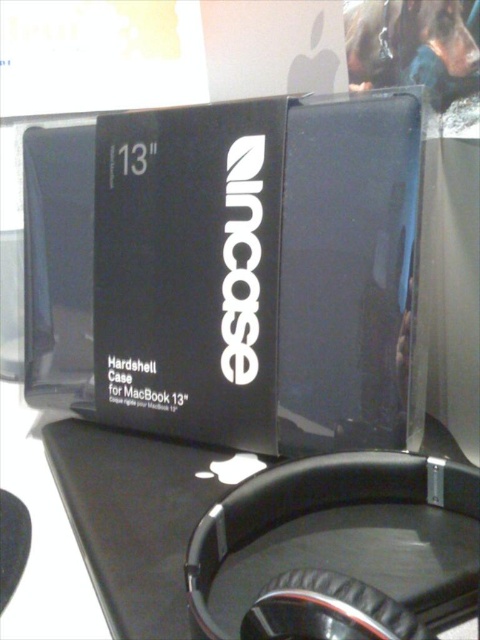
Question: Which point is closer to the camera taking this photo?

Choices:
 (A) (x=72, y=561)
 (B) (x=140, y=144)

Answer: (A)

Question: Does black hardshell case at center lie in front of black matte table at center?

Choices:
 (A) no
 (B) yes

Answer: (A)

Question: Is black hardshell case at center further to the viewer compared to black matte table at center?

Choices:
 (A) yes
 (B) no

Answer: (A)

Question: Among these points, which one is farthest from the camera?

Choices:
 (A) 61,616
 (B) 154,381

Answer: (B)

Question: Can you confirm if black hardshell case at center is thinner than black matte table at center?

Choices:
 (A) yes
 (B) no

Answer: (B)

Question: Which point appears farthest from the camera in this image?

Choices:
 (A) [x=31, y=442]
 (B) [x=332, y=184]

Answer: (A)